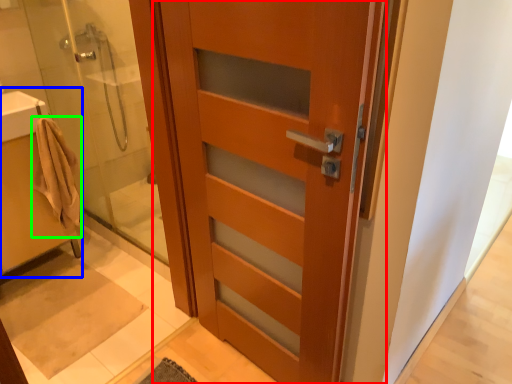
Question: Which object is the farthest from door (highlighted by a red box)? Choose among these: sink (highlighted by a blue box) or bathrobe (highlighted by a green box).

Choices:
 (A) sink
 (B) bathrobe

Answer: (A)